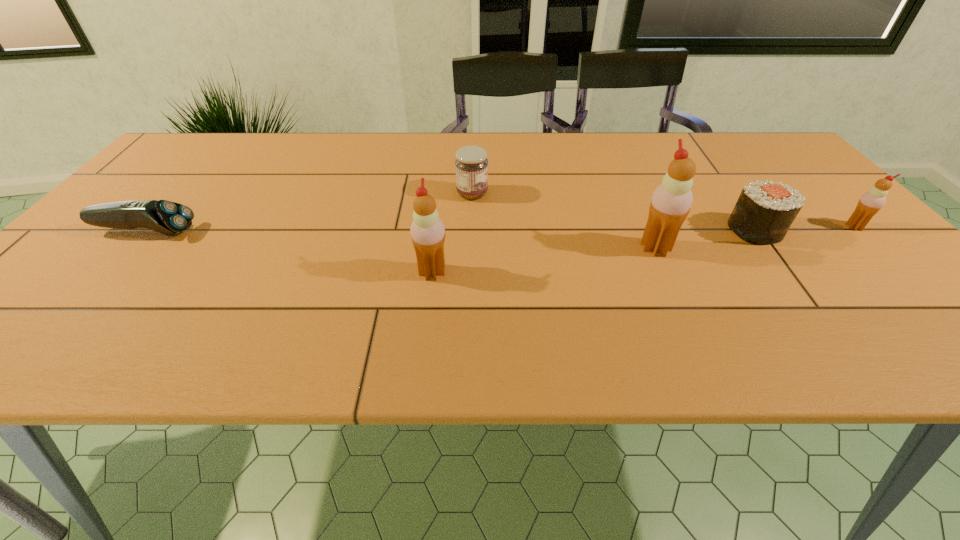
Where is `the fifth object from left to right`? This screenshot has width=960, height=540. the fifth object from left to right is located at coordinates (764, 212).

Identify the location of vacant space located at the front with a straw on the second object from left to right. (491, 272).

Where is `free point located at the front with a straw on the third object from right to left`? free point located at the front with a straw on the third object from right to left is located at coordinates (843, 248).

Find the location of a particular element. free space located 0.200m at the front with a straw on the farthest icecream is located at coordinates (922, 294).

I want to click on vacant space located 0.350m on the front label of the jam, so click(x=623, y=193).

At what (x,y) coordinates should I click in order to perform the action: click on free space located 0.080m on the head of the shortest object. Please return your answer as a coordinate pair (x, y). Image resolution: width=960 pixels, height=540 pixels. Looking at the image, I should click on (229, 232).

Where is `free region located on the front of the sushi`? The height and width of the screenshot is (540, 960). free region located on the front of the sushi is located at coordinates (794, 284).

This screenshot has width=960, height=540. I want to click on object situated at the left edge, so click(x=166, y=217).

This screenshot has height=540, width=960. In order to click on object at the right edge in this screenshot , I will do `click(871, 202)`.

At what (x,y) coordinates should I click in order to perform the action: click on free space at the far edge of the desktop. Please return your answer as a coordinate pair (x, y). The image size is (960, 540). Looking at the image, I should click on (246, 168).